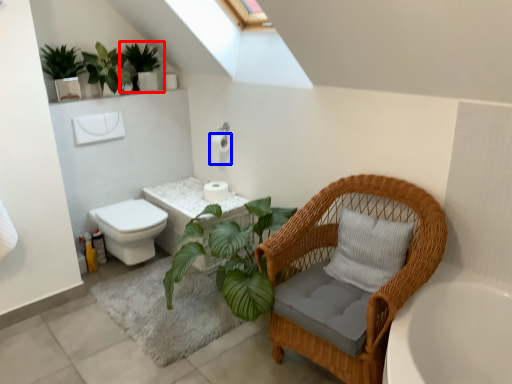
Question: Among these objects, which one is farthest to the camera, houseplant (highlighted by a red box) or toilet paper (highlighted by a blue box)?

Choices:
 (A) houseplant
 (B) toilet paper

Answer: (B)